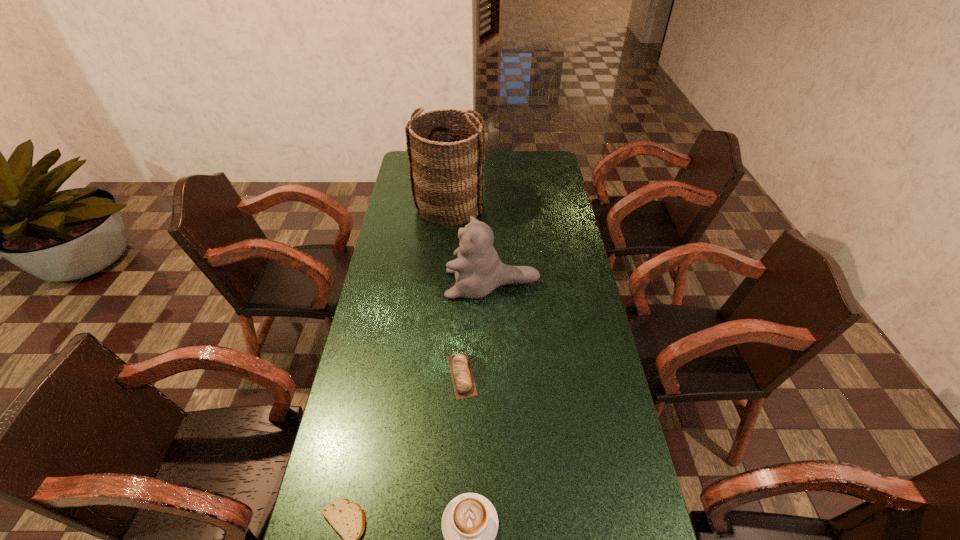
Locate an element on the screen. basket is located at coordinates (446, 157).

This screenshot has width=960, height=540. Identify the location of the tallest object. (446, 157).

Find the location of `cat`. cat is located at coordinates [478, 270].

Find the location of a particular element. The width and height of the screenshot is (960, 540). the second tallest object is located at coordinates (478, 270).

The width and height of the screenshot is (960, 540). Identify the location of the third nearest object. (464, 386).

Locate an element on the screen. The image size is (960, 540). the second shortest object is located at coordinates (464, 386).

Where is `free space located on the back of the farthest object`? free space located on the back of the farthest object is located at coordinates (453, 168).

Find the location of a particular element. The image size is (960, 540). vacant space situated on the face of the second farthest object is located at coordinates (395, 284).

Where is `vacant space located 0.190m on the face of the second farthest object`? This screenshot has width=960, height=540. vacant space located 0.190m on the face of the second farthest object is located at coordinates click(x=395, y=284).

The height and width of the screenshot is (540, 960). Find the location of `free space located 0.160m on the face of the second farthest object`. free space located 0.160m on the face of the second farthest object is located at coordinates (403, 284).